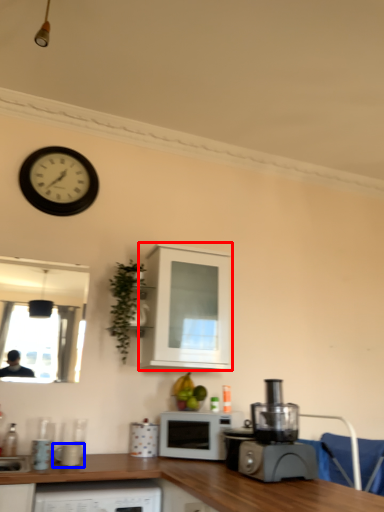
Question: Which object appears closest to the camera in this image, cabinetry (highlighted by a red box) or appliance (highlighted by a blue box)?

Choices:
 (A) cabinetry
 (B) appliance

Answer: (B)